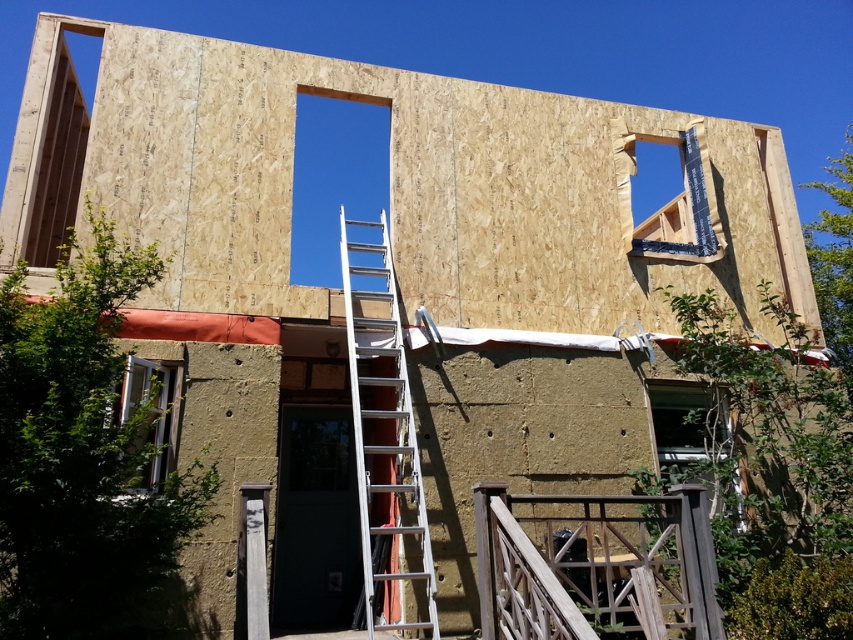
Can you confirm if natural wood siding at upper center is positioned to the left of clear glass window at lower right?

Indeed, natural wood siding at upper center is positioned on the left side of clear glass window at lower right.

Which is above, natural wood siding at upper center or clear glass window at lower right?

natural wood siding at upper center

Who is more forward, [225,285] or [705,404]?

Point [225,285]

This screenshot has height=640, width=853. In order to click on natural wood siding at upper center in this screenshot , I will do click(x=389, y=180).

Who is shorter, clear glass window at lower right or clear glass window at upper center?

With less height is clear glass window at lower right.

Is point (705, 412) less distant than point (663, 244)?

Yes.

Locate an element on the screen. This screenshot has height=640, width=853. clear glass window at lower right is located at coordinates 689,426.

Is the position of natural wood siding at upper center less distant than that of clear glass window at upper center?

Yes, natural wood siding at upper center is in front of clear glass window at upper center.

Does natural wood siding at upper center appear over clear glass window at upper center?

Incorrect, natural wood siding at upper center is not positioned above clear glass window at upper center.

You are a GUI agent. You are given a task and a screenshot of the screen. Output one action in this format:
    pyautogui.click(x=<x>, y=<y>)
    Task: Click on the natural wood siding at upper center
    The width and height of the screenshot is (853, 640).
    Given the screenshot: What is the action you would take?
    pyautogui.click(x=389, y=180)